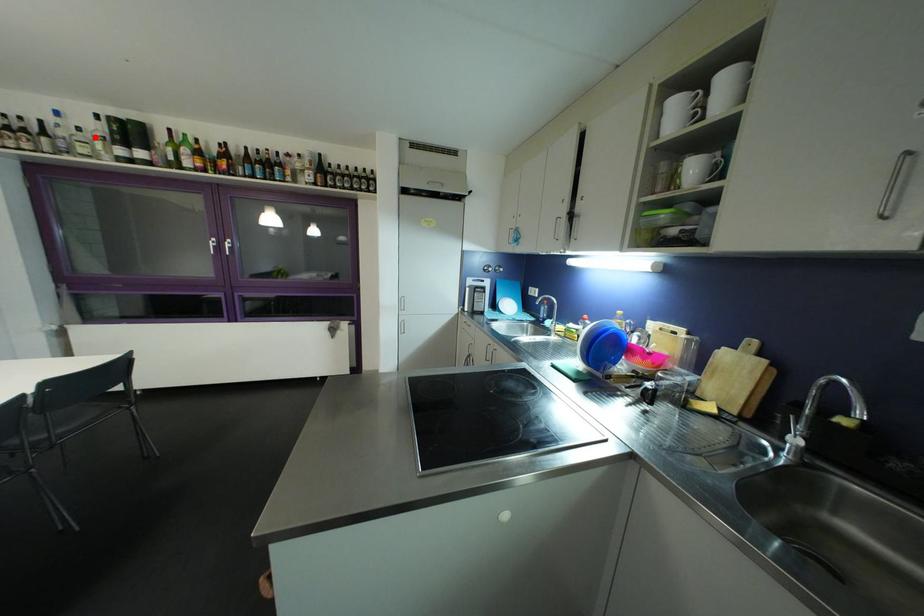
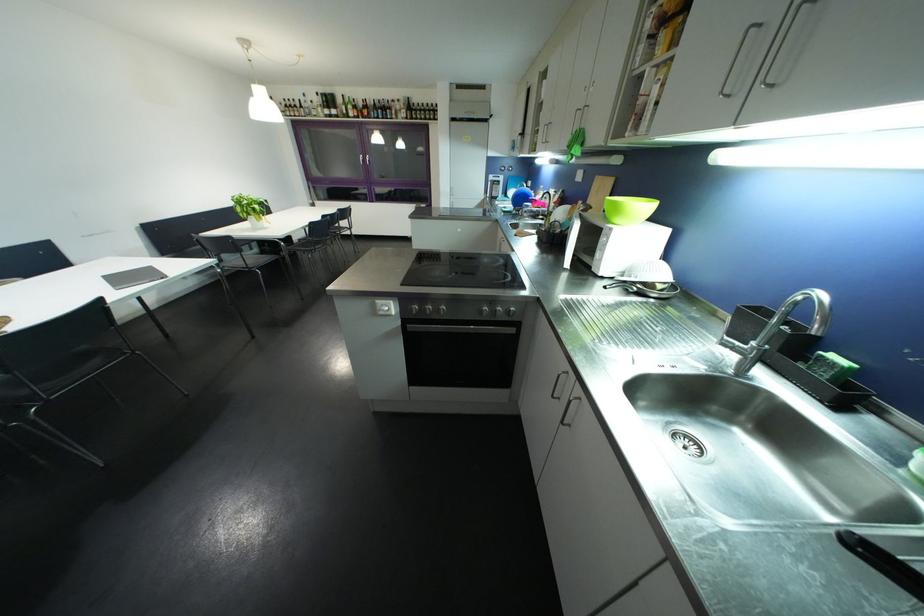
Where in the second image is the point corresponding to the highlighted location from the first image?

(322, 107)